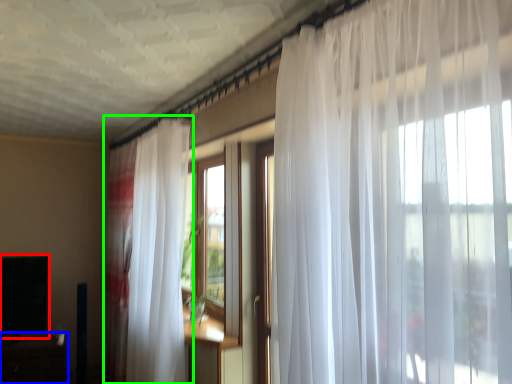
Question: Considering the real-world distances, which object is closest to window screen (highlighted by a red box)? table (highlighted by a blue box) or curtain (highlighted by a green box).

Choices:
 (A) table
 (B) curtain

Answer: (A)